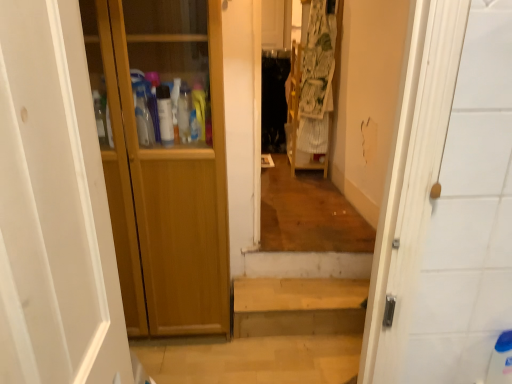
Question: From a real-world perspective, is wooden stairs at center above or below wooden cabinet at left?

Choices:
 (A) above
 (B) below

Answer: (A)

Question: From the image's perspective, is wooden stairs at center above or below wooden cabinet at left?

Choices:
 (A) above
 (B) below

Answer: (A)

Question: Which object is the farthest from the wooden stairs at center?

Choices:
 (A) printed fabric laundry at center
 (B) wooden cabinet at left
 (C) wooden cabinet at left

Answer: (A)

Question: Based on their relative distances, which object is nearer to the wooden cabinet at left?

Choices:
 (A) printed fabric laundry at center
 (B) wooden cabinet at left
 (C) wooden stairs at center

Answer: (C)